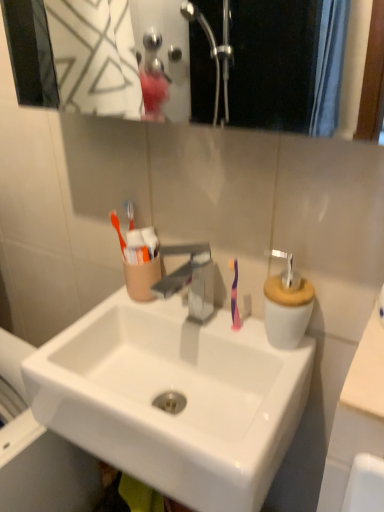
Question: Is white glossy sink at center positioned with its back to purple glossy toothbrush at center?

Choices:
 (A) yes
 (B) no

Answer: (B)

Question: Are white glossy sink at center and purple glossy toothbrush at center far apart?

Choices:
 (A) yes
 (B) no

Answer: (B)

Question: Does white glossy sink at center turn towards purple glossy toothbrush at center?

Choices:
 (A) no
 (B) yes

Answer: (A)

Question: Considering the relative sizes of white glossy sink at center and purple glossy toothbrush at center in the image provided, is white glossy sink at center shorter than purple glossy toothbrush at center?

Choices:
 (A) no
 (B) yes

Answer: (A)

Question: Is white glossy sink at center positioned before purple glossy toothbrush at center?

Choices:
 (A) yes
 (B) no

Answer: (A)

Question: Considering the relative sizes of white glossy sink at center and purple glossy toothbrush at center in the image provided, is white glossy sink at center bigger than purple glossy toothbrush at center?

Choices:
 (A) yes
 (B) no

Answer: (A)

Question: From the image's perspective, would you say beige matte counter top at right, arranged as the 1th counter top when viewed from the right, is shown under white ceramic soap dispenser at right?

Choices:
 (A) yes
 (B) no

Answer: (A)

Question: Can you confirm if beige matte counter top at right, arranged as the second counter top when viewed from the left, is taller than white ceramic soap dispenser at right?

Choices:
 (A) no
 (B) yes

Answer: (A)

Question: Is beige matte counter top at right, arranged as the second counter top when viewed from the left, oriented away from white ceramic soap dispenser at right?

Choices:
 (A) yes
 (B) no

Answer: (B)

Question: Is beige matte counter top at right, arranged as the 1th counter top when viewed from the right, not inside white ceramic soap dispenser at right?

Choices:
 (A) yes
 (B) no

Answer: (A)

Question: Are beige matte counter top at right, arranged as the second counter top when viewed from the left, and white ceramic soap dispenser at right beside each other?

Choices:
 (A) no
 (B) yes

Answer: (A)

Question: From a real-world perspective, does beige matte counter top at right, arranged as the 1th counter top when viewed from the right, sit lower than white ceramic soap dispenser at right?

Choices:
 (A) no
 (B) yes

Answer: (A)

Question: From a real-world perspective, does white glossy sink at center sit lower than beige matte counter top at right, arranged as the 1th counter top when viewed from the right?

Choices:
 (A) yes
 (B) no

Answer: (A)